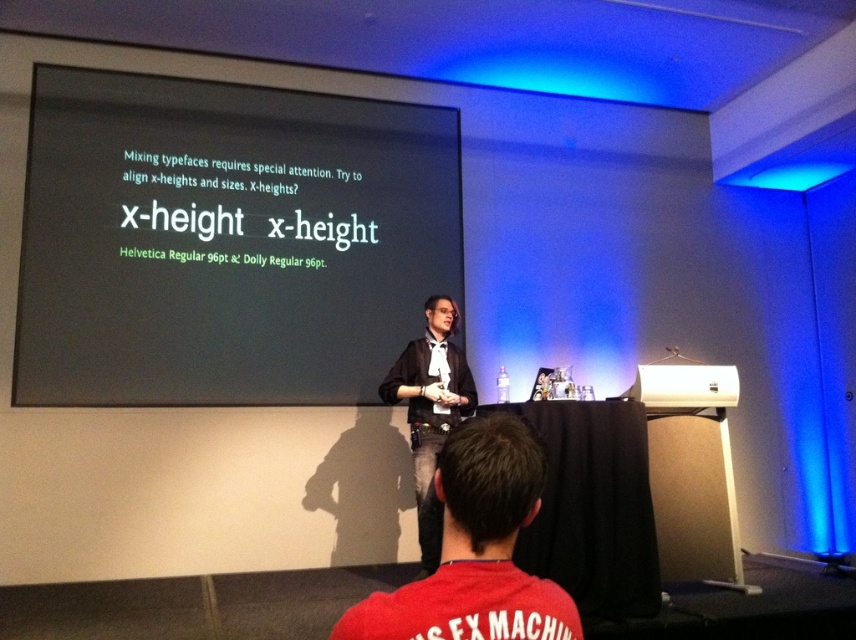
Question: Is black leather jacket at center bigger than white plastic projector at center?

Choices:
 (A) no
 (B) yes

Answer: (B)

Question: Which of these objects is positioned farthest from the black leather jacket at center?

Choices:
 (A) red cotton shirt at lower center
 (B) white plastic projector at center

Answer: (A)

Question: Which of the following is the closest to the observer?

Choices:
 (A) (446, 499)
 (B) (429, 444)

Answer: (A)

Question: Based on their relative distances, which object is farther from the black leather jacket at center?

Choices:
 (A) black matte projection screen at upper center
 (B) red cotton shirt at lower center
 (C) white plastic projector at center

Answer: (B)

Question: Can you confirm if red cotton shirt at lower center is smaller than black leather jacket at center?

Choices:
 (A) no
 (B) yes

Answer: (B)

Question: Can you confirm if black matte projection screen at upper center is smaller than red cotton shirt at lower center?

Choices:
 (A) no
 (B) yes

Answer: (A)